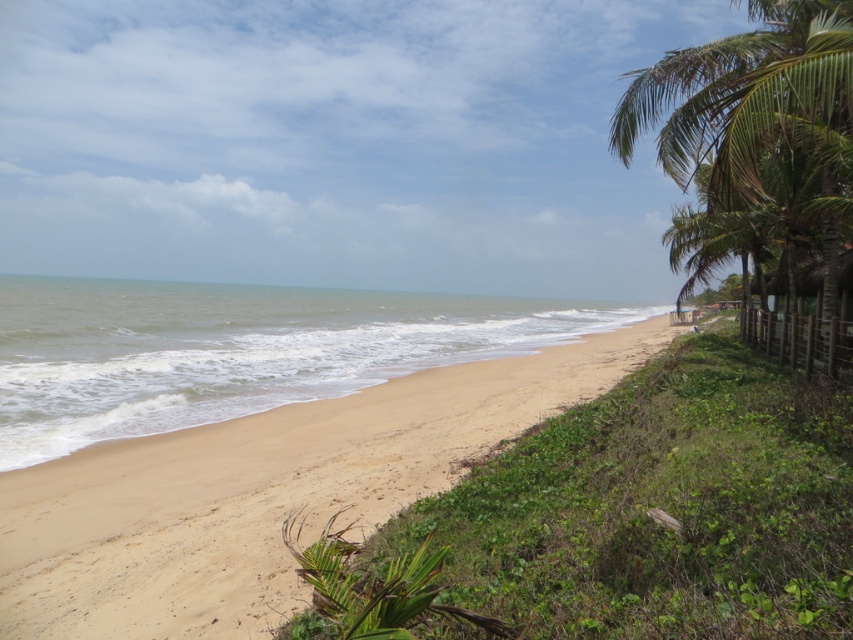
Is light brown sand at center bigger than green leafy palm tree at right?

No.

Between light brown sand at center and green leafy palm tree at right, which one has less height?

With less height is light brown sand at center.

Locate an element on the screen. Image resolution: width=853 pixels, height=640 pixels. light brown sand at center is located at coordinates (262, 493).

Locate an element on the screen. light brown sand at center is located at coordinates (262, 493).